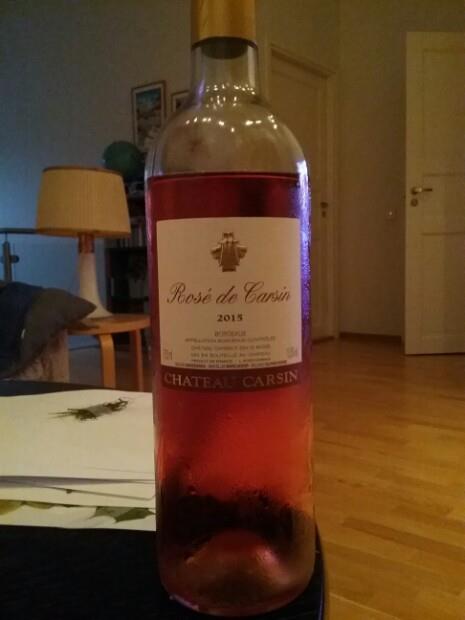
The height and width of the screenshot is (620, 465). I want to click on white door, so click(x=413, y=38), click(x=444, y=139), click(x=418, y=195), click(x=416, y=308), click(x=450, y=343).